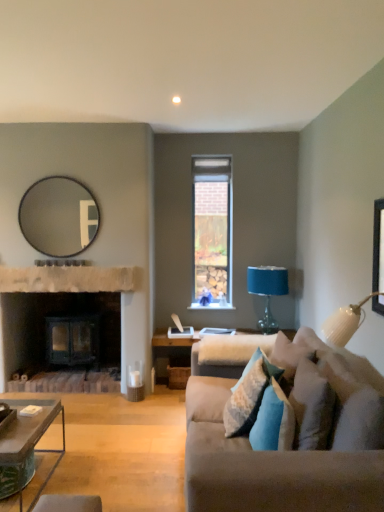
Question: From the image's perspective, does velvet beige couch at right appear lower than rustic stone fireplace at center?

Choices:
 (A) yes
 (B) no

Answer: (A)

Question: Could you tell me if velvet beige couch at right is turned towards rustic stone fireplace at center?

Choices:
 (A) yes
 (B) no

Answer: (A)

Question: Considering the relative positions of velvet beige couch at right and rustic stone fireplace at center in the image provided, is velvet beige couch at right behind rustic stone fireplace at center?

Choices:
 (A) yes
 (B) no

Answer: (B)

Question: From the image's perspective, is velvet beige couch at right on rustic stone fireplace at center?

Choices:
 (A) no
 (B) yes

Answer: (A)

Question: Is velvet beige couch at right completely or partially outside of rustic stone fireplace at center?

Choices:
 (A) yes
 (B) no

Answer: (A)

Question: From a real-world perspective, is velvet beige couch at right positioned under rustic stone fireplace at center based on gravity?

Choices:
 (A) no
 (B) yes

Answer: (B)

Question: Does green textured coffee table at lower left appear on the right side of blue fabric-covered lampshade at right?

Choices:
 (A) yes
 (B) no

Answer: (B)

Question: Considering the relative sizes of green textured coffee table at lower left and blue fabric-covered lampshade at right in the image provided, is green textured coffee table at lower left taller than blue fabric-covered lampshade at right?

Choices:
 (A) no
 (B) yes

Answer: (A)

Question: Is green textured coffee table at lower left to the left of blue fabric-covered lampshade at right from the viewer's perspective?

Choices:
 (A) yes
 (B) no

Answer: (A)

Question: From the image's perspective, does green textured coffee table at lower left appear lower than blue fabric-covered lampshade at right?

Choices:
 (A) yes
 (B) no

Answer: (A)

Question: Does green textured coffee table at lower left have a lesser height compared to blue fabric-covered lampshade at right?

Choices:
 (A) no
 (B) yes

Answer: (B)

Question: Is green textured coffee table at lower left facing towards blue fabric-covered lampshade at right?

Choices:
 (A) no
 (B) yes

Answer: (A)

Question: Is rustic stone fireplace at center aimed at black matte picture frame at upper right?

Choices:
 (A) no
 (B) yes

Answer: (A)